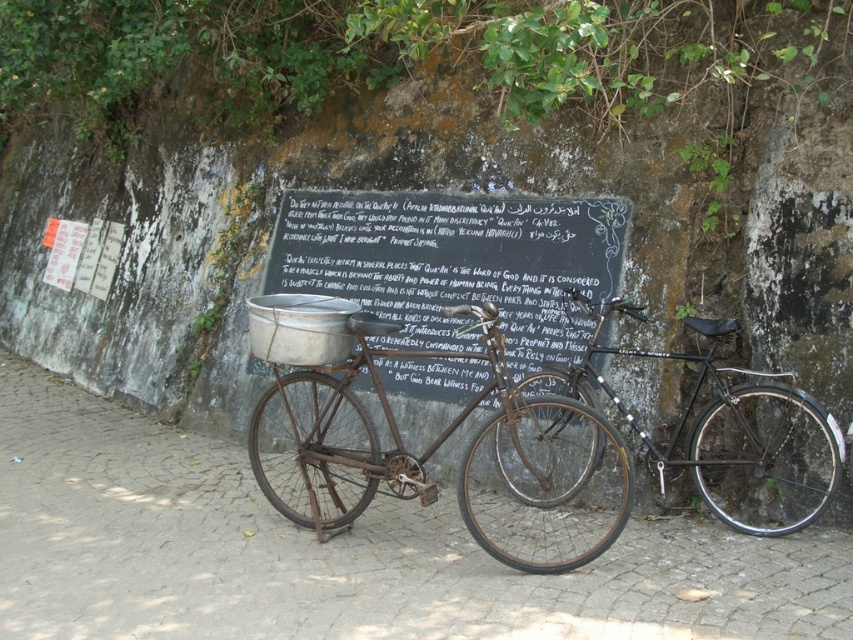
You are a painter planning to paint both the black chalkboard at center and the black matte bicycle at center. Since you want to use the same amount of paint for each, which object should you paint first to ensure you have enough paint for both?

The black chalkboard at center is larger than the black matte bicycle at center, so you should paint the black chalkboard at center first to ensure you have enough paint for both.

You are a painter who wants to paint the rusty metal bicycle at center and the black chalkboard at center. Since you need to paint the objects in the correct order, which object should you paint first?

The rusty metal bicycle at center is in front of the black chalkboard at center, so you should paint the rusty metal bicycle at center first to ensure proper layering.

You are a painter who wants to paint the black chalkboard at center and the black matte bicycle at center. Since both are black, you need to determine which one is higher to decide where to start. According to the scene, which object is positioned higher?

The black chalkboard at center is located above the black matte bicycle at center, so the black chalkboard at center is higher.